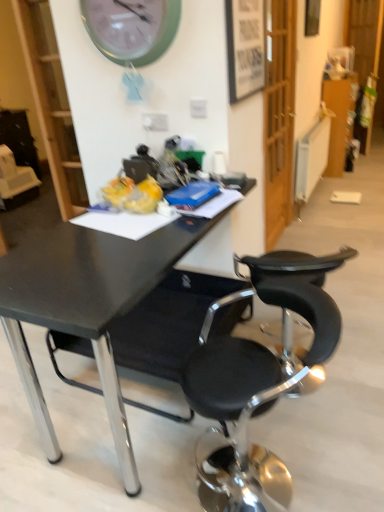
Image resolution: width=384 pixels, height=512 pixels. Describe the element at coordinates (51, 103) in the screenshot. I see `white glossy bookshelf at upper left` at that location.

This screenshot has height=512, width=384. Describe the element at coordinates (131, 28) in the screenshot. I see `green plastic wall clock at upper center` at that location.

Image resolution: width=384 pixels, height=512 pixels. I want to click on wooden framed poster at upper center, the second picture frame in the right-to-left sequence, so click(245, 47).

This screenshot has height=512, width=384. I want to click on black leather stool at lower right, so click(x=259, y=372).

The width and height of the screenshot is (384, 512). Describe the element at coordinates (86, 306) in the screenshot. I see `black matte desk at center` at that location.

Consider the image. Measure the distance between point (108, 276) and camera.

Point (108, 276) is 4.60 feet away from camera.

Describe the element at coordinates (312, 17) in the screenshot. I see `wooden picture frame at upper right, marked as the 2th picture frame in a left-to-right arrangement` at that location.

At what (x,y) coordinates should I click in order to perform the action: click on white glossy bookshelf at upper left. Please return your answer as a coordinate pair (x, y). Image resolution: width=384 pixels, height=512 pixels. Looking at the image, I should click on (51, 103).

Is wooden framed poster at upper center, which is the 1th picture frame from bottom to top, facing towards green plastic wall clock at upper center?

No, wooden framed poster at upper center, which is the 1th picture frame from bottom to top, is not turned towards green plastic wall clock at upper center.

Between wooden framed poster at upper center, which is counted as the 2th picture frame, starting from the back, and green plastic wall clock at upper center, which one has larger width?

green plastic wall clock at upper center.

The image size is (384, 512). What are the coordinates of `wall clock that appears on the left of wooden framed poster at upper center, acting as the 2th picture frame starting from the top` in the screenshot? It's located at (131, 28).

From the image's perspective, is wooden framed poster at upper center, which is counted as the 2th picture frame, starting from the back, above or below green plastic wall clock at upper center?

From the image's perspective, wooden framed poster at upper center, which is counted as the 2th picture frame, starting from the back, appears below green plastic wall clock at upper center.

Considering the positions of objects green plastic wall clock at upper center and black matte desk at center in the image provided, who is in front, green plastic wall clock at upper center or black matte desk at center?

black matte desk at center is closer to the camera.

Image resolution: width=384 pixels, height=512 pixels. Find the location of `desk in front of the green plastic wall clock at upper center`. desk in front of the green plastic wall clock at upper center is located at coordinates (86, 306).

How far apart are green plastic wall clock at upper center and black matte desk at center?

green plastic wall clock at upper center is 1.20 meters from black matte desk at center.

How many degrees apart are the facing directions of green plastic wall clock at upper center and black matte desk at center?

There is a 91.5-degree angle between the facing directions of green plastic wall clock at upper center and black matte desk at center.

Is black matte desk at center in contact with wooden framed poster at upper center, the second picture frame in the right-to-left sequence?

No, black matte desk at center is not next to wooden framed poster at upper center, the second picture frame in the right-to-left sequence.

Is wooden framed poster at upper center, which is the 1th picture frame from bottom to top, completely or partially inside black matte desk at center?

Definitely not — wooden framed poster at upper center, which is the 1th picture frame from bottom to top, is not inside black matte desk at center.

Visually, is black matte desk at center positioned to the left or to the right of wooden framed poster at upper center, which is the 1th picture frame from left to right?

From the image, it's evident that black matte desk at center is to the left of wooden framed poster at upper center, which is the 1th picture frame from left to right.

Which of these two, black matte desk at center or wooden framed poster at upper center, which is counted as the 2th picture frame, starting from the back, is thinner?

Thinner between the two is wooden framed poster at upper center, which is counted as the 2th picture frame, starting from the back.

Would you say green plastic wall clock at upper center is outside wooden picture frame at upper right, the 2th picture frame when ordered from bottom to top?

Indeed, green plastic wall clock at upper center is completely outside wooden picture frame at upper right, the 2th picture frame when ordered from bottom to top.

From the image's perspective, is green plastic wall clock at upper center located above or below wooden picture frame at upper right, which appears as the first picture frame when viewed from the back?

green plastic wall clock at upper center is below wooden picture frame at upper right, which appears as the first picture frame when viewed from the back.

Is green plastic wall clock at upper center aimed at wooden picture frame at upper right, arranged as the 2th picture frame when viewed from the front?

No, green plastic wall clock at upper center is not facing towards wooden picture frame at upper right, arranged as the 2th picture frame when viewed from the front.

The height and width of the screenshot is (512, 384). Identify the location of wall clock that is below the wooden picture frame at upper right, the 2th picture frame when ordered from bottom to top (from the image's perspective). (131, 28).

Are wooden framed poster at upper center, acting as the 2th picture frame starting from the top, and white glossy bookshelf at upper left beside each other?

No, wooden framed poster at upper center, acting as the 2th picture frame starting from the top, is not beside white glossy bookshelf at upper left.

Based on the photo, considering the sizes of objects wooden framed poster at upper center, acting as the 2th picture frame starting from the top, and white glossy bookshelf at upper left in the image provided, who is wider, wooden framed poster at upper center, acting as the 2th picture frame starting from the top, or white glossy bookshelf at upper left?

white glossy bookshelf at upper left is wider.

Looking at this image, who is more distant, wooden framed poster at upper center, which is the 1th picture frame from bottom to top, or white glossy bookshelf at upper left?

white glossy bookshelf at upper left is further from the camera.

Based on the photo, considering the sizes of objects black leather stool at lower right and white glossy bookshelf at upper left in the image provided, who is shorter, black leather stool at lower right or white glossy bookshelf at upper left?

black leather stool at lower right is shorter.

The image size is (384, 512). I want to click on chair below the white glossy bookshelf at upper left (from the image's perspective), so (x=259, y=372).

From the image's perspective, which object appears higher, black leather stool at lower right or white glossy bookshelf at upper left?

From the image's view, white glossy bookshelf at upper left is above.

Is black leather stool at lower right far from white glossy bookshelf at upper left?

Yes.

Which object is closer to the camera taking this photo, white glossy bookshelf at upper left or green plastic wall clock at upper center?

green plastic wall clock at upper center is in front.

Is white glossy bookshelf at upper left oriented towards green plastic wall clock at upper center?

No, white glossy bookshelf at upper left is not turned towards green plastic wall clock at upper center.

Between point (59, 101) and point (150, 35), which one is positioned in front?

The point (150, 35) is closer.

Can you confirm if white glossy bookshelf at upper left is positioned to the left of green plastic wall clock at upper center?

Yes.

You are a GUI agent. You are given a task and a screenshot of the screen. Output one action in this format:
    pyautogui.click(x=<x>, y=<y>)
    Task: Click on the wall clock above the wooden framed poster at upper center, which is counted as the 2th picture frame, starting from the back (from the image's perspective)
    Image resolution: width=384 pixels, height=512 pixels.
    Given the screenshot: What is the action you would take?
    pyautogui.click(x=131, y=28)

In the image, there is a green plastic wall clock at upper center. Identify the location of desk below it (from a real-world perspective). The height and width of the screenshot is (512, 384). (86, 306).

Considering their positions, is green plastic wall clock at upper center positioned closer to white glossy bookshelf at upper left than black leather stool at lower right?

Among the two, green plastic wall clock at upper center is located nearer to white glossy bookshelf at upper left.

Considering their positions, is wooden picture frame at upper right, arranged as the 2th picture frame when viewed from the front, positioned further to white glossy bookshelf at upper left than black leather stool at lower right?

wooden picture frame at upper right, arranged as the 2th picture frame when viewed from the front, is further to white glossy bookshelf at upper left.

When comparing their distances from white glossy bookshelf at upper left, does wooden framed poster at upper center, which is the 1th picture frame from left to right, or black leather stool at lower right seem closer?

wooden framed poster at upper center, which is the 1th picture frame from left to right, lies closer to white glossy bookshelf at upper left than the other object.

Looking at this image, considering their positions, is white glossy bookshelf at upper left positioned further to green plastic wall clock at upper center than wooden picture frame at upper right, marked as the 2th picture frame in a left-to-right arrangement?

wooden picture frame at upper right, marked as the 2th picture frame in a left-to-right arrangement, lies further to green plastic wall clock at upper center than the other object.

Considering their positions, is wooden picture frame at upper right, marked as the 2th picture frame in a left-to-right arrangement, positioned further to wooden framed poster at upper center, the second picture frame in the right-to-left sequence, than green plastic wall clock at upper center?

wooden picture frame at upper right, marked as the 2th picture frame in a left-to-right arrangement, is further to wooden framed poster at upper center, the second picture frame in the right-to-left sequence.

Estimate the real-world distances between objects in this image. Which object is further from green plastic wall clock at upper center, white glossy bookshelf at upper left or black matte desk at center?

black matte desk at center.

Which object lies nearer to the anchor point black leather stool at lower right, wooden framed poster at upper center, the second picture frame in the right-to-left sequence, or white glossy bookshelf at upper left?

wooden framed poster at upper center, the second picture frame in the right-to-left sequence, is closer to black leather stool at lower right.

Which object lies further to the anchor point green plastic wall clock at upper center, black leather stool at lower right or white glossy bookshelf at upper left?

The object further to green plastic wall clock at upper center is black leather stool at lower right.

Where is `wall clock between white glossy bookshelf at upper left and wooden picture frame at upper right, the 2th picture frame when ordered from bottom to top`? Image resolution: width=384 pixels, height=512 pixels. wall clock between white glossy bookshelf at upper left and wooden picture frame at upper right, the 2th picture frame when ordered from bottom to top is located at coordinates (131, 28).

At what (x,y) coordinates should I click in order to perform the action: click on wall clock between wooden picture frame at upper right, the 2th picture frame when ordered from bottom to top, and black matte desk at center, in the vertical direction. Please return your answer as a coordinate pair (x, y). Image resolution: width=384 pixels, height=512 pixels. Looking at the image, I should click on (131, 28).

Locate an element on the screen. The width and height of the screenshot is (384, 512). picture frame between green plastic wall clock at upper center and black leather stool at lower right in the vertical direction is located at coordinates (245, 47).

What are the coordinates of `bookshelf between wooden picture frame at upper right, which appears as the first picture frame when viewed from the back, and black matte desk at center in the up-down direction` in the screenshot? It's located at (51, 103).